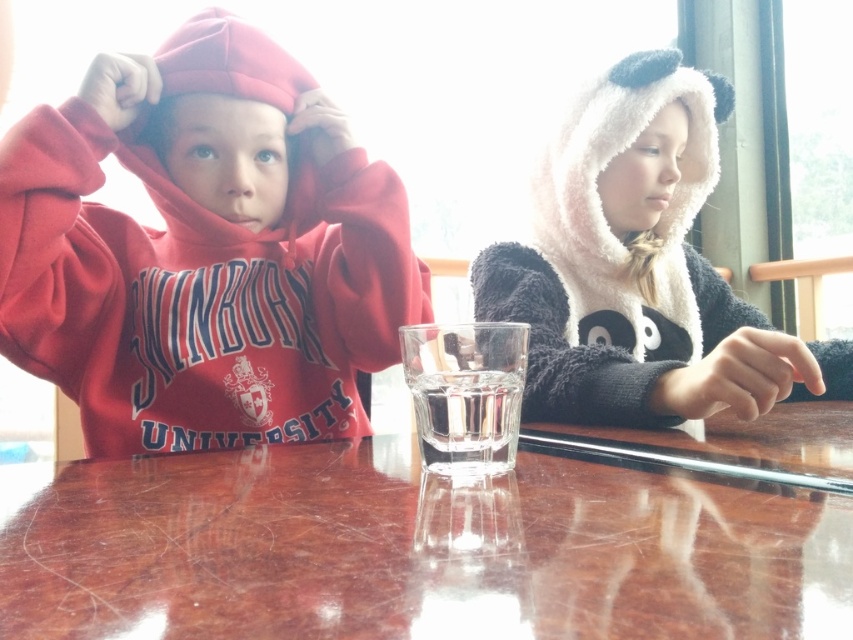
Which is behind, point (165, 336) or point (555, 266)?

The point (555, 266) is more distant.

Describe the element at coordinates (204, 250) in the screenshot. I see `matte red hoodie at left` at that location.

At what (x,y) coordinates should I click in order to perform the action: click on matte red hoodie at left. Please return your answer as a coordinate pair (x, y). The image size is (853, 640). Looking at the image, I should click on (204, 250).

Between glossy brown table at center and matte red hoodie at left, which one appears on the right side from the viewer's perspective?

glossy brown table at center

Is glossy brown table at center in front of matte red hoodie at left?

Yes.

Is point (554, 557) behind point (364, 262)?

No, (554, 557) is closer to viewer.

You are a GUI agent. You are given a task and a screenshot of the screen. Output one action in this format:
    pyautogui.click(x=<x>, y=<y>)
    Task: Click on the glossy brown table at center
    
    Given the screenshot: What is the action you would take?
    pyautogui.click(x=413, y=552)

Between point (71, 488) and point (740, 300), which one is positioned behind?

Positioned behind is point (740, 300).

Does glossy brown table at center come behind fuzzy white hood at upper right?

No, glossy brown table at center is closer to the viewer.

At what (x,y) coordinates should I click in order to perform the action: click on glossy brown table at center. Please return your answer as a coordinate pair (x, y). The height and width of the screenshot is (640, 853). Looking at the image, I should click on (413, 552).

Identify the location of glossy brown table at center. (413, 552).